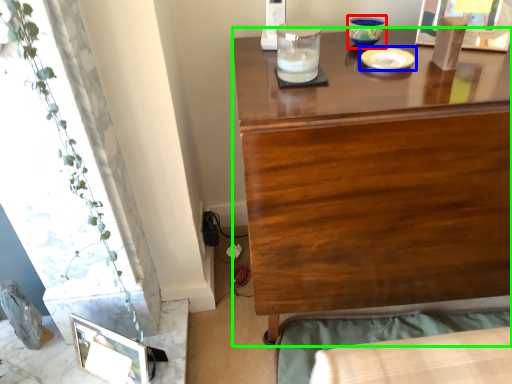
Question: Which object is the closest to the candle holder (highlighted by a red box)? Choose among these: tableware (highlighted by a blue box) or desk (highlighted by a green box).

Choices:
 (A) tableware
 (B) desk

Answer: (A)